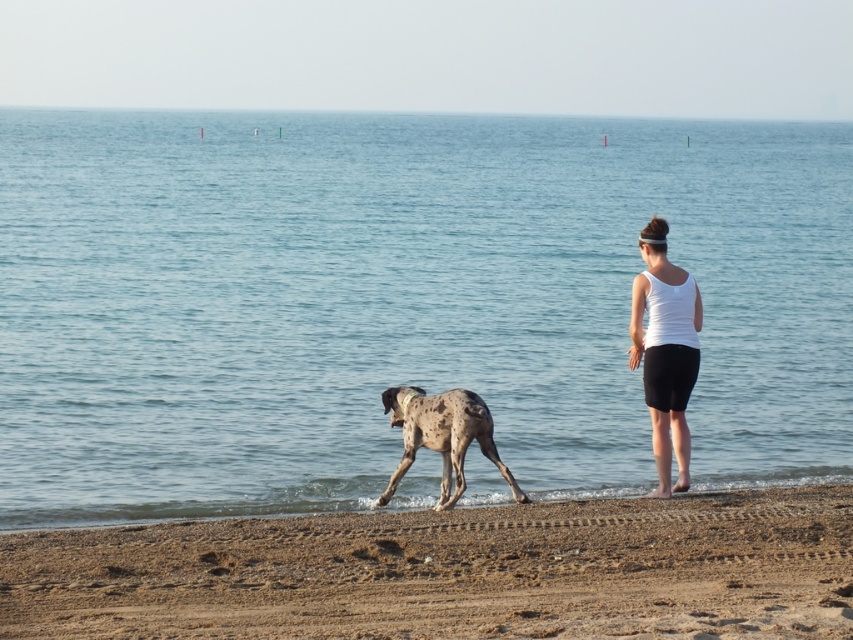
You are standing on the beach and want to throw a ball to your dog. The ball is currently in your hand. If you want to throw it as far as possible, should you aim towards the blue water at center or the sandy beach with some faint tire tracks visible?

The blue water at center is 13.97 meters away from the camera, so you should aim towards the blue water at center to throw the ball as far as possible since it is farther away than the sandy beach with some faint tire tracks visible.

You are standing on the brown sandy beach at lower center and want to get to the spotted fur dog at center. Which direction should you move to reach it?

The brown sandy beach at lower center is in front of the spotted fur dog at center, so you should move backward to reach the spotted fur dog at center.

You are planning to build a small sandcastle on the beach. Given the blue water at center and the spotted fur dog at center, which one is wider?

The blue water at center is wider than the spotted fur dog at center.